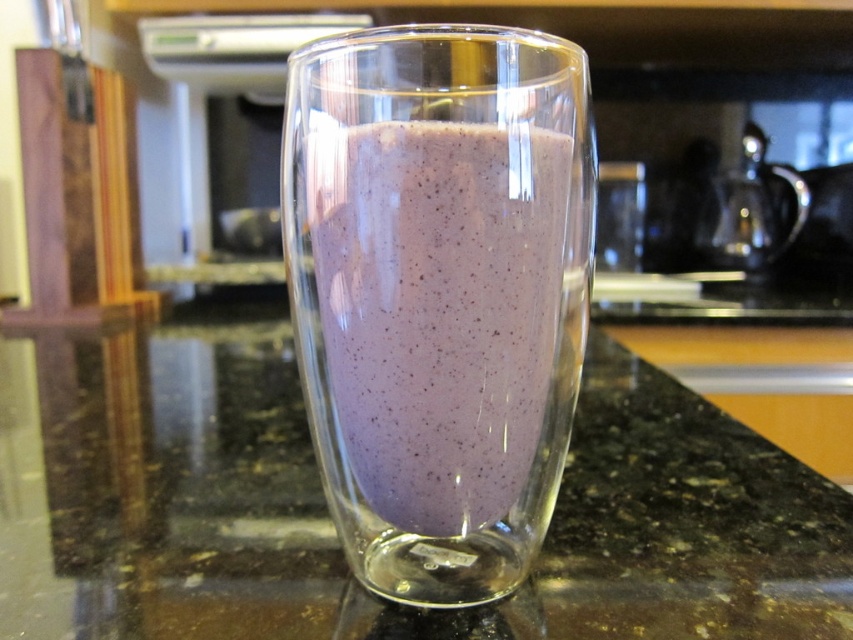
Between purple glass at center and purple smoothie at center, which one is positioned lower?

purple smoothie at center is below.

Is point (822, 534) positioned after point (383, 202)?

Yes, point (822, 534) is farther from viewer.

Does point (326, 560) come farther from viewer compared to point (361, 314)?

Yes, point (326, 560) is behind point (361, 314).

Identify the location of purple glass at center. (326, 508).